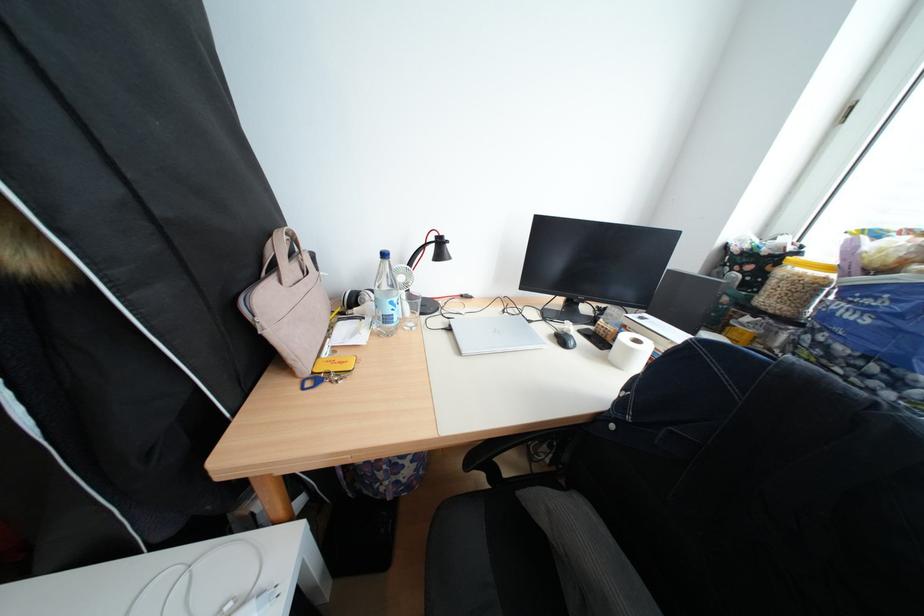
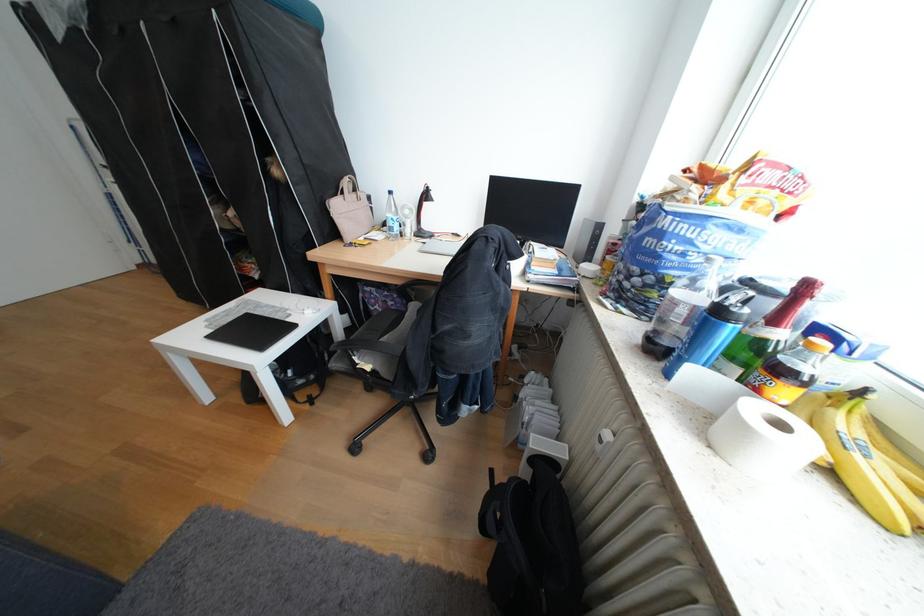
In a continuous first-person perspective shot, in which direction is the camera moving?

The cameraman walked toward right, backward.